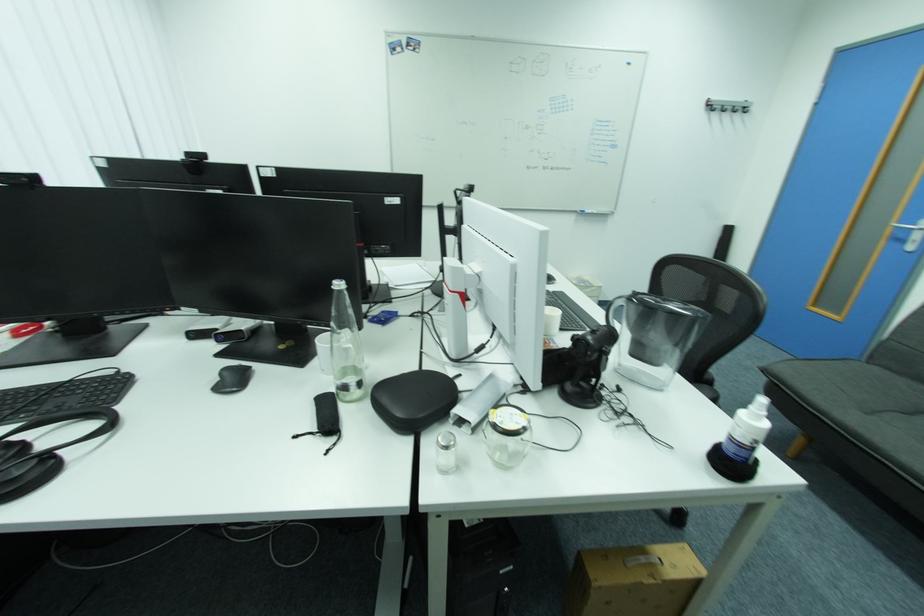
Where is `sofa sitting surface`? This screenshot has height=616, width=924. sofa sitting surface is located at coordinates click(881, 390).